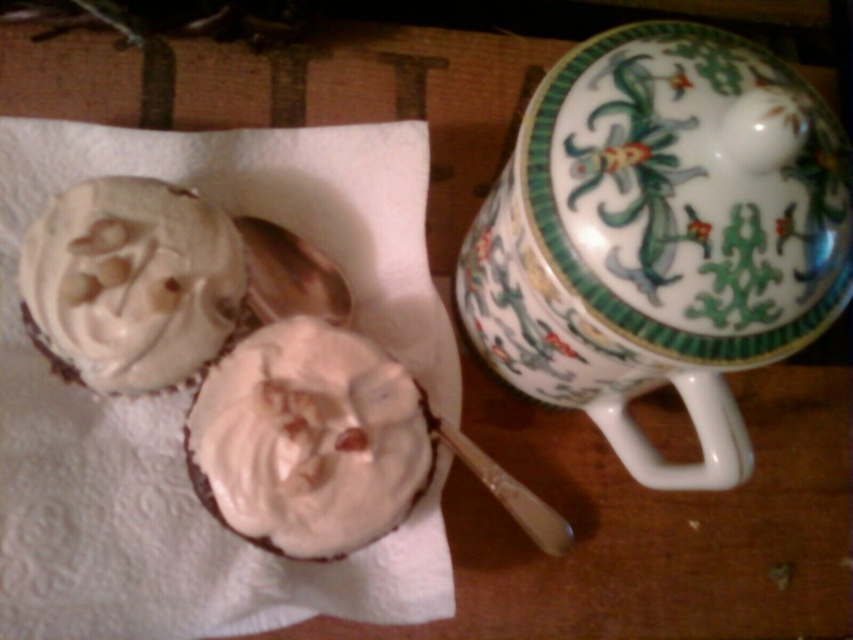
From the picture: Which is more to the left, white paper towel at upper left or creamy matte frosting at center?

white paper towel at upper left is more to the left.

Can you confirm if white paper towel at upper left is taller than creamy matte frosting at center?

Yes, white paper towel at upper left is taller than creamy matte frosting at center.

Find the location of a particular element. This screenshot has height=640, width=853. white paper towel at upper left is located at coordinates (190, 392).

From the picture: Is porcelain mug with floral design at upper center closer to the viewer compared to whipped cream cupcake at left?

Yes, porcelain mug with floral design at upper center is in front of whipped cream cupcake at left.

Is porcelain mug with floral design at upper center further to camera compared to whipped cream cupcake at left?

No, it is in front of whipped cream cupcake at left.

Is point (824, 234) less distant than point (74, 312)?

Yes, it is.

This screenshot has height=640, width=853. Find the location of `porcelain mug with floral design at upper center`. porcelain mug with floral design at upper center is located at coordinates (660, 236).

Between porcelain mug with floral design at upper center and white paper towel at upper left, which one appears on the right side from the viewer's perspective?

From the viewer's perspective, porcelain mug with floral design at upper center appears more on the right side.

At what (x,y) coordinates should I click in order to perform the action: click on porcelain mug with floral design at upper center. Please return your answer as a coordinate pair (x, y). The height and width of the screenshot is (640, 853). Looking at the image, I should click on (660, 236).